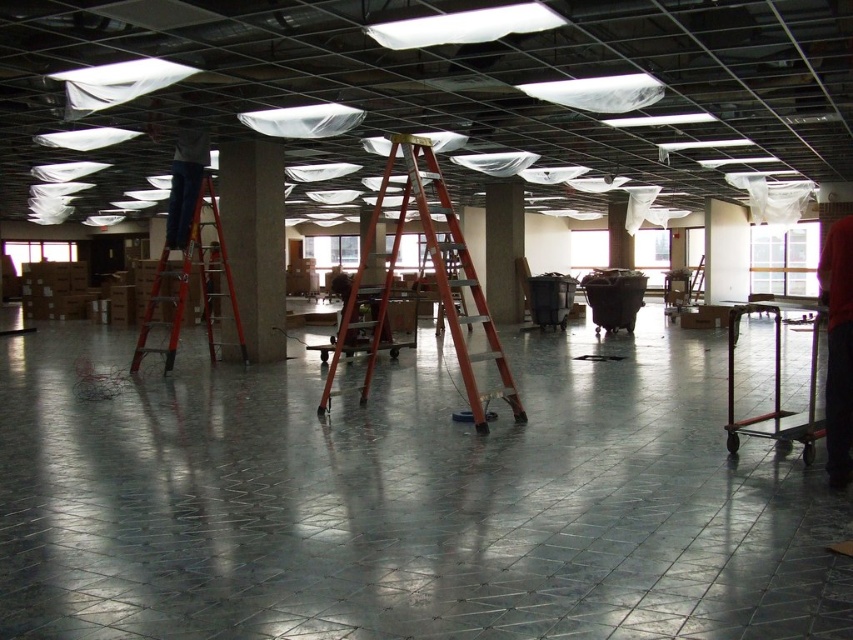
Looking at this image, you are standing at the center of the room. Which direction should you walk to reach the red plastic ladder at left?

Since the red plastic ladder at left is located at point (189, 284), you should walk to the left to reach it.

You are a worker needing to reach the ceiling fixtures for maintenance. You see the orange metallic ladder at center and the red plastic ladder at left. Which ladder should you use to safely access the ceiling fixtures without needing to move the other ladder?

The orange metallic ladder at center is located above the red plastic ladder at left, so you should use the orange metallic ladder at center to safely reach the ceiling fixtures without needing to move the other ladder.